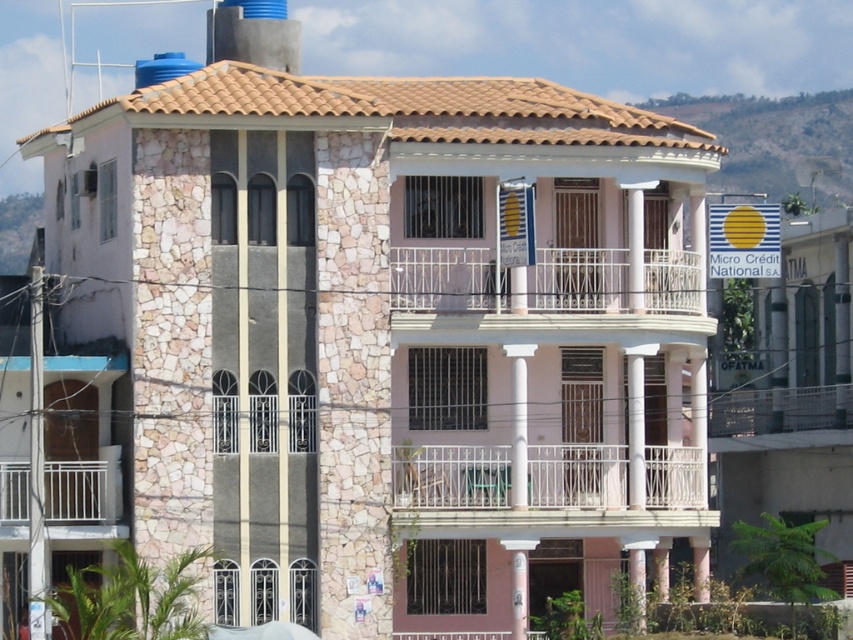
Question: Estimate the real-world distances between objects in this image. Which object is farther from the white metal balcony at center?

Choices:
 (A) white metal balcony at lower left
 (B) white wrought iron balcony at center

Answer: (A)

Question: Which point is farther to the camera?

Choices:
 (A) (102, 476)
 (B) (630, 512)
 (C) (593, 280)

Answer: (C)

Question: Can you confirm if white wrought iron balcony at center is positioned to the left of white metal balcony at lower left?

Choices:
 (A) no
 (B) yes

Answer: (A)

Question: Does white metal balcony at center have a smaller size compared to white metal balcony at lower left?

Choices:
 (A) no
 (B) yes

Answer: (B)

Question: Which object is farther from the camera taking this photo?

Choices:
 (A) white metal balcony at center
 (B) white wrought iron balcony at center
 (C) white metal balcony at lower left

Answer: (A)

Question: Is white metal balcony at center below white metal balcony at lower left?

Choices:
 (A) yes
 (B) no

Answer: (B)